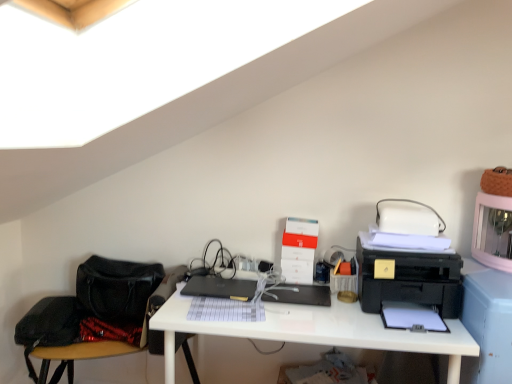
Question: Should I look upward or downward to see black matte laptop at center?

Choices:
 (A) up
 (B) down

Answer: (B)

Question: Considering the relative sizes of black leather swivel chair at lower left and black matte laptop at center in the image provided, is black leather swivel chair at lower left shorter than black matte laptop at center?

Choices:
 (A) no
 (B) yes

Answer: (A)

Question: Does black leather swivel chair at lower left have a smaller size compared to black matte laptop at center?

Choices:
 (A) yes
 (B) no

Answer: (B)

Question: From the image's perspective, does black leather swivel chair at lower left appear lower than black matte laptop at center?

Choices:
 (A) no
 (B) yes

Answer: (B)

Question: From a real-world perspective, is black leather swivel chair at lower left on black matte laptop at center?

Choices:
 (A) yes
 (B) no

Answer: (B)

Question: From a real-world perspective, is black leather swivel chair at lower left under black matte laptop at center?

Choices:
 (A) yes
 (B) no

Answer: (A)

Question: Can you confirm if black leather swivel chair at lower left is wider than black matte laptop at center?

Choices:
 (A) no
 (B) yes

Answer: (B)

Question: From a real-world perspective, is white glossy desk at center located beneath black leather swivel chair at lower left?

Choices:
 (A) yes
 (B) no

Answer: (B)

Question: From the image's perspective, would you say white glossy desk at center is shown under black leather swivel chair at lower left?

Choices:
 (A) yes
 (B) no

Answer: (B)

Question: Is white glossy desk at center bigger than black leather swivel chair at lower left?

Choices:
 (A) yes
 (B) no

Answer: (A)

Question: From a real-world perspective, is white glossy desk at center positioned over black leather swivel chair at lower left based on gravity?

Choices:
 (A) no
 (B) yes

Answer: (B)

Question: Can you see white glossy desk at center touching black leather swivel chair at lower left?

Choices:
 (A) no
 (B) yes

Answer: (A)

Question: Is white glossy desk at center facing towards black leather swivel chair at lower left?

Choices:
 (A) yes
 (B) no

Answer: (B)

Question: From the image's perspective, is black plastic register at center on white glossy desk at center?

Choices:
 (A) yes
 (B) no

Answer: (A)